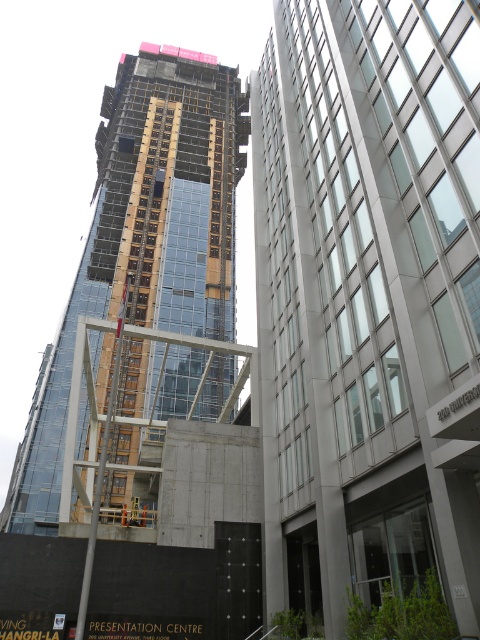
Is point (288, 513) farther from camera compared to point (142, 44)?

No.

Does point (467, 627) come closer to viewer compared to point (225, 321)?

That is True.

Does point (338, 484) come closer to viewer compared to point (157, 403)?

Yes, it is in front of point (157, 403).

At what (x,y) coordinates should I click in order to perform the action: click on glassy concrete skyscraper at center. Please return your answer as a coordinate pair (x, y). This screenshot has height=640, width=480. Looking at the image, I should click on (368, 300).